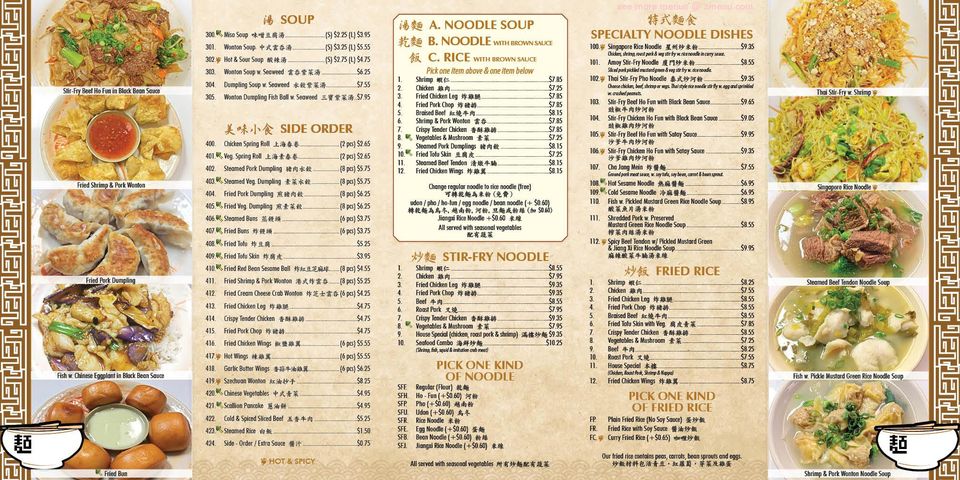
Where is `photos of dishes on the left side`? The image size is (960, 480). photos of dishes on the left side is located at coordinates (120, 35), (109, 118), (114, 227), (120, 296), (111, 400).